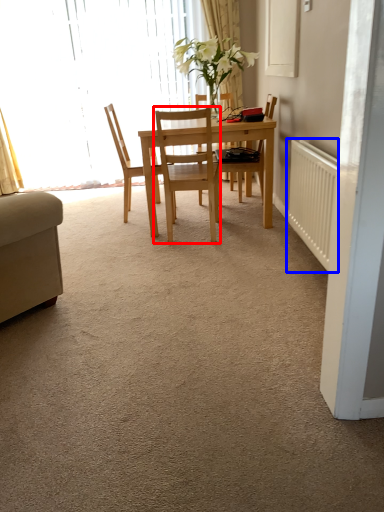
Question: Among these objects, which one is nearest to the camera, chair (highlighted by a red box) or radiator (highlighted by a blue box)?

Choices:
 (A) chair
 (B) radiator

Answer: (B)